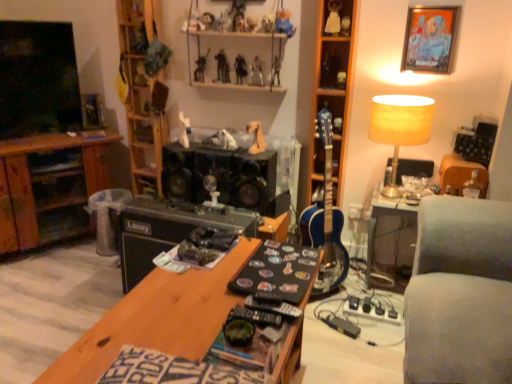
Identify the location of vacant area that is situated to the right of white plastic toy at center, the 16th toy from the right. click(x=210, y=142).